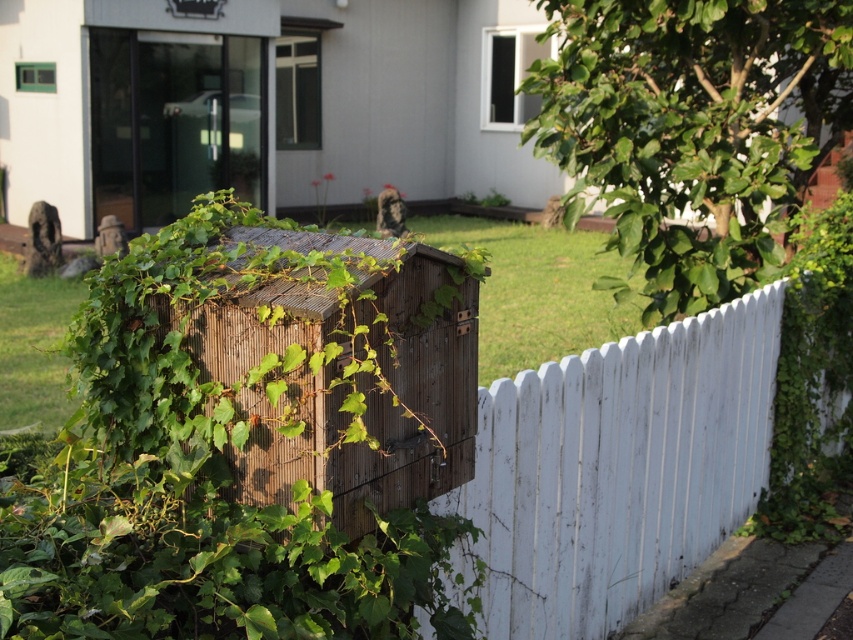
Question: Can you confirm if green leafy ivy at center is positioned to the right of white wooden fence at center?

Choices:
 (A) yes
 (B) no

Answer: (B)

Question: Does green leafy ivy at center have a greater width compared to white wooden fence at center?

Choices:
 (A) no
 (B) yes

Answer: (A)

Question: Does green leafy ivy at center appear on the left side of white wooden fence at center?

Choices:
 (A) no
 (B) yes

Answer: (B)

Question: Among these points, which one is nearest to the camera?

Choices:
 (A) (154, 586)
 (B) (619, 602)

Answer: (A)

Question: Which object is closer to the camera taking this photo?

Choices:
 (A) green leafy ivy at center
 (B) white wooden fence at center

Answer: (A)

Question: Which of the following is the closest to the observer?

Choices:
 (A) (201, 230)
 (B) (577, 426)

Answer: (A)